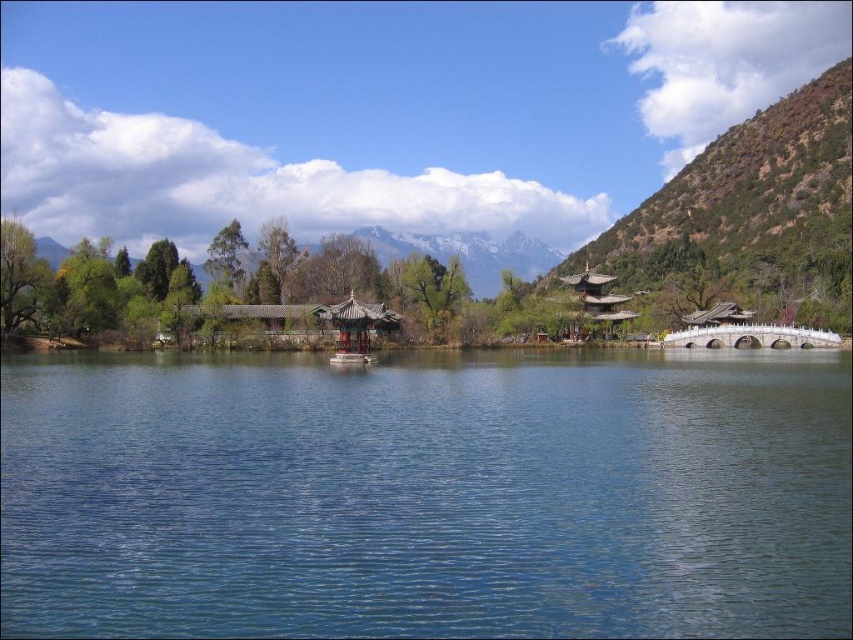
Measure the distance from transparent blue water at center to green textured mountain at upper right.

transparent blue water at center and green textured mountain at upper right are 138.03 meters apart from each other.

Who is taller, transparent blue water at center or green textured mountain at upper right?

green textured mountain at upper right is taller.

In order to click on transparent blue water at center in this screenshot , I will do `click(427, 496)`.